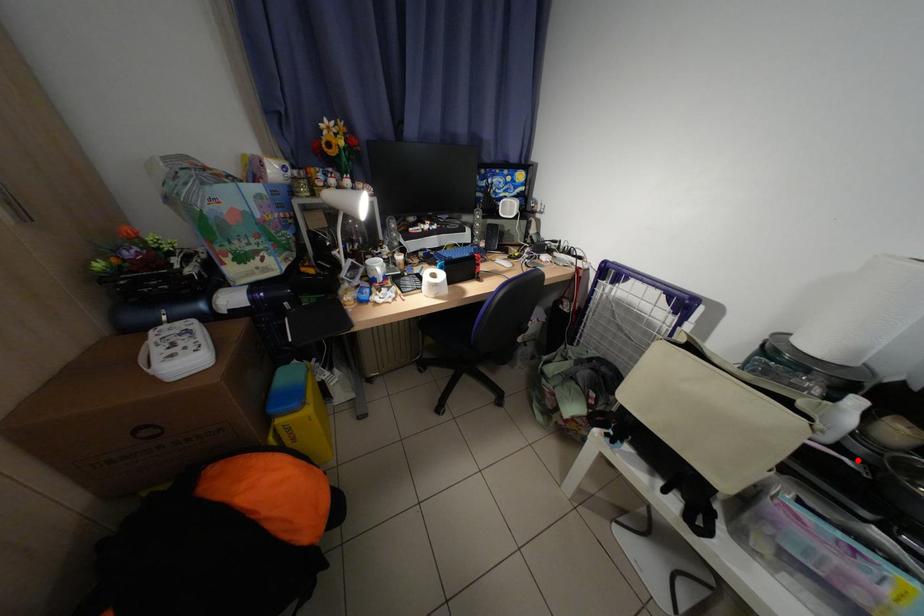
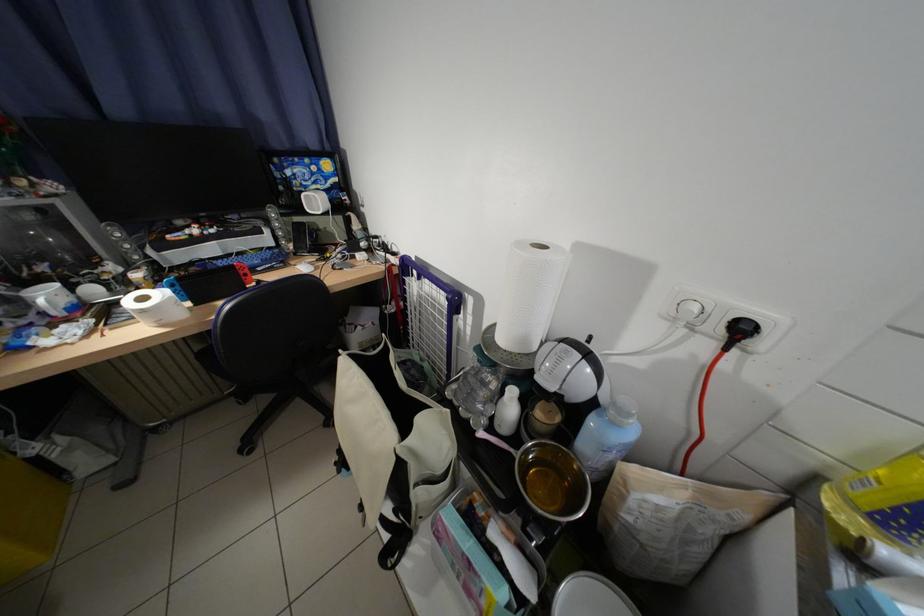
Where in the second image is the point corresponding to the highlighted location from the first image?

(524, 453)